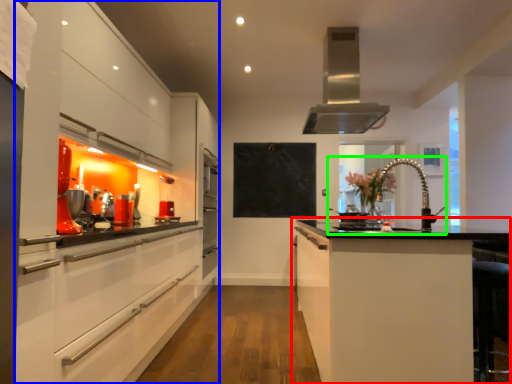
Question: Considering the real-world distances, which object is farthest from cabinetry (highlighted by a red box)? cabinetry (highlighted by a blue box) or sink (highlighted by a green box)?

Choices:
 (A) cabinetry
 (B) sink

Answer: (A)